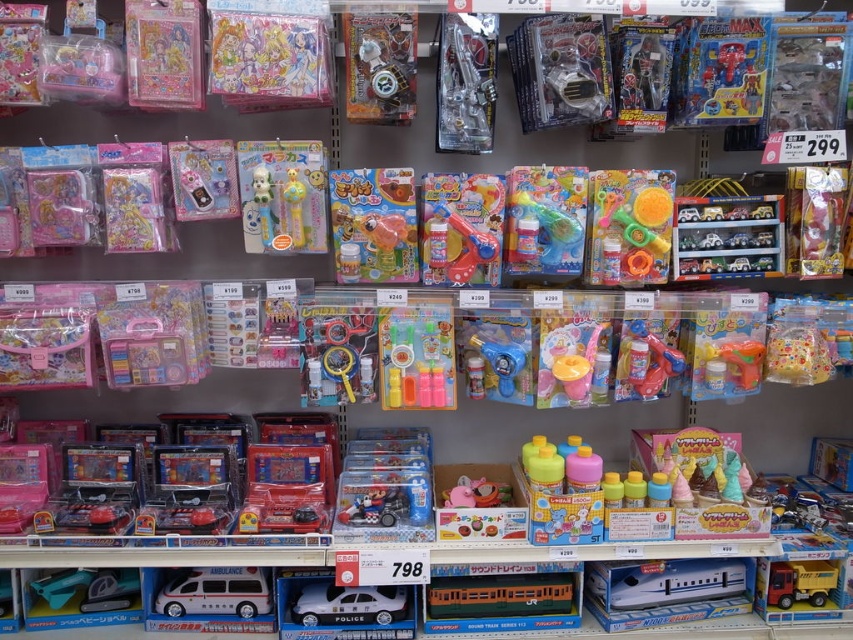
Identify the location of white plastic airplane at lower center. This screenshot has height=640, width=853. (665, 580).

Can you confirm if white plastic airplane at lower center is thinner than translucent plastic toy gun at center-right?

No, white plastic airplane at lower center is not thinner than translucent plastic toy gun at center-right.

Find the location of a particular element. white plastic airplane at lower center is located at coordinates (665, 580).

The width and height of the screenshot is (853, 640). Identify the location of metallic orange train at center. tap(498, 595).

Is point (438, 584) positioned behind point (450, 493)?

No, (438, 584) is in front of (450, 493).

What do you see at coordinates (498, 595) in the screenshot? I see `metallic orange train at center` at bounding box center [498, 595].

Find the location of `metallic orange train at center`. metallic orange train at center is located at coordinates (498, 595).

Does yellow matte truck at lower right have a greater width compared to pink plastic piggy bank at center?

No.

Does point (828, 563) come closer to viewer compared to point (497, 502)?

Yes, it is in front of point (497, 502).

Locate an element on the screen. This screenshot has height=640, width=853. yellow matte truck at lower right is located at coordinates (799, 582).